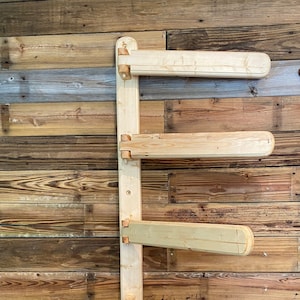
Locate an element on the screen. This screenshot has height=300, width=300. grey wood is located at coordinates coord(105,97).